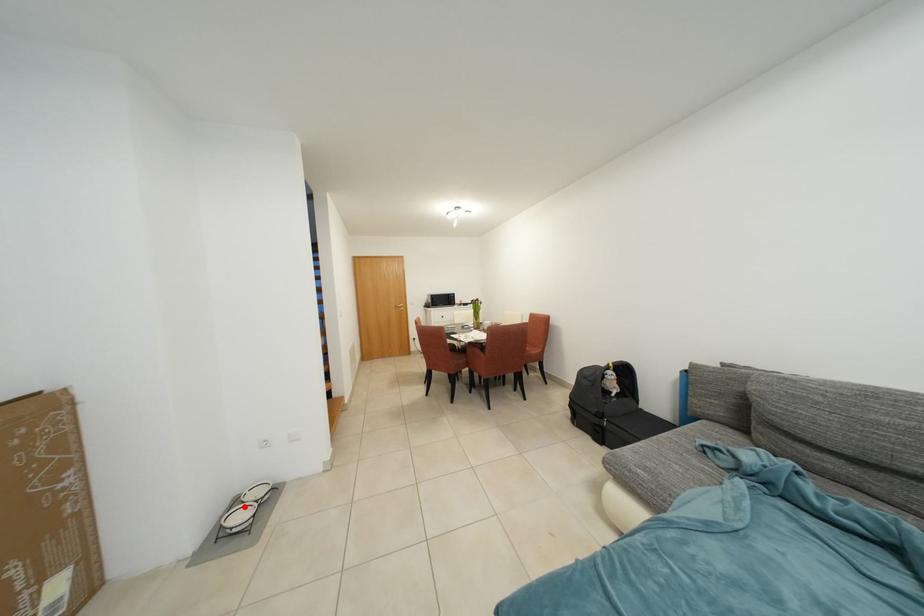
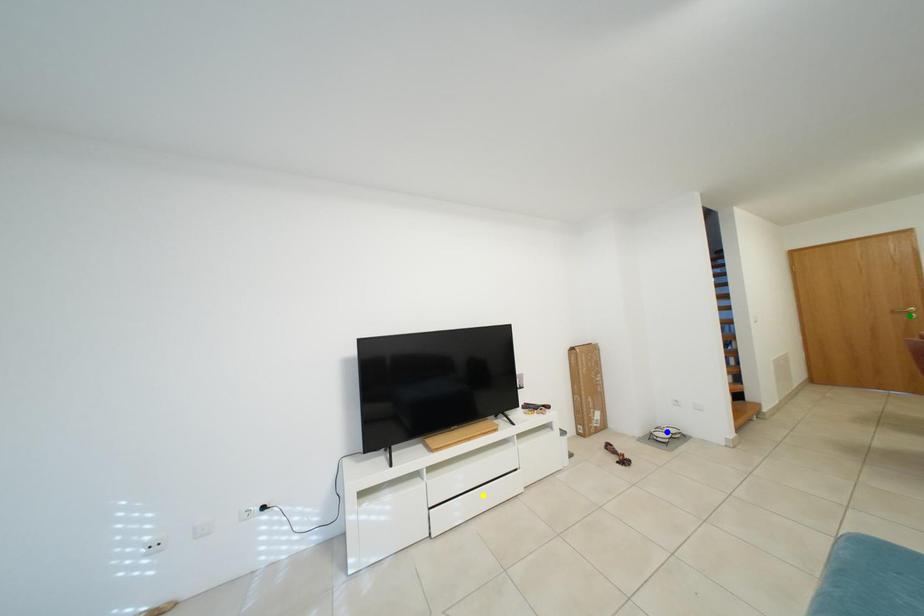
Question: I am providing you with two images of the same scene from different viewpoints. A red point is marked on the first image. You are given multiple points on the second image. Which point in image 2 represents the same 3d spot as the red point in image 1?

Choices:
 (A) yellow point
 (B) green point
 (C) blue point

Answer: (C)